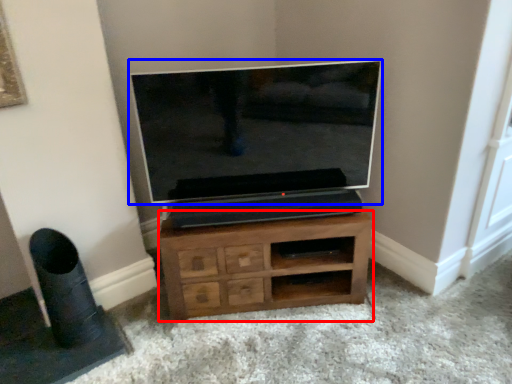
Question: Among these objects, which one is nearest to the camera, chest of drawers (highlighted by a red box) or television (highlighted by a blue box)?

Choices:
 (A) chest of drawers
 (B) television

Answer: (B)